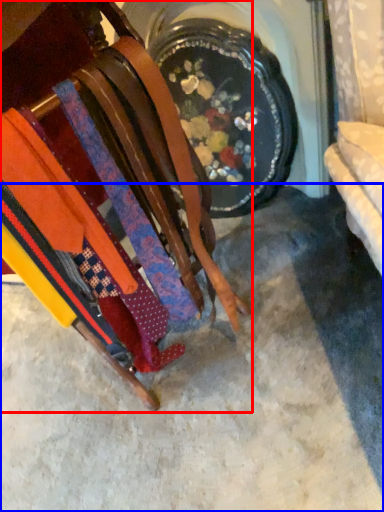
Question: Which point is closer to the camera, furniture (highlighted by a red box) or concrete (highlighted by a blue box)?

Choices:
 (A) furniture
 (B) concrete

Answer: (A)